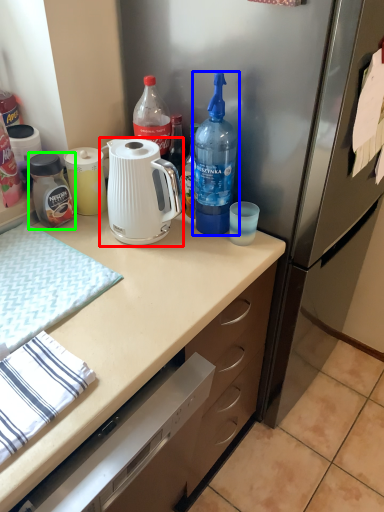
Question: Which is farther away from kettle (highlighted by a red box)? bottle (highlighted by a blue box) or bottle (highlighted by a green box)?

Choices:
 (A) bottle
 (B) bottle

Answer: (B)